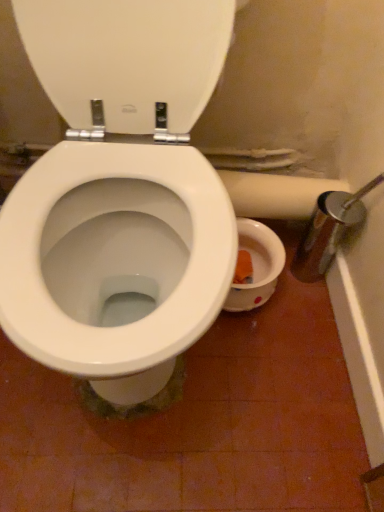
Question: Based on their sizes in the image, would you say white matte toilet paper at right is bigger or smaller than white glossy toilet seat at center?

Choices:
 (A) big
 (B) small

Answer: (B)

Question: Considering their positions, is white matte toilet paper at right located in front of or behind white glossy toilet seat at center?

Choices:
 (A) behind
 (B) front

Answer: (A)

Question: Looking at their shapes, would you say white matte toilet paper at right is wider or thinner than white glossy toilet seat at center?

Choices:
 (A) thin
 (B) wide

Answer: (B)

Question: Does point (142, 114) appear closer or farther from the camera than point (292, 199)?

Choices:
 (A) farther
 (B) closer

Answer: (B)

Question: In terms of height, does white glossy toilet seat at center look taller or shorter compared to white matte toilet paper at right?

Choices:
 (A) short
 (B) tall

Answer: (B)

Question: Is white glossy toilet seat at center wider or thinner than white matte toilet paper at right?

Choices:
 (A) wide
 (B) thin

Answer: (B)

Question: From the image's perspective, is white glossy toilet seat at center positioned above or below white matte toilet paper at right?

Choices:
 (A) above
 (B) below

Answer: (A)